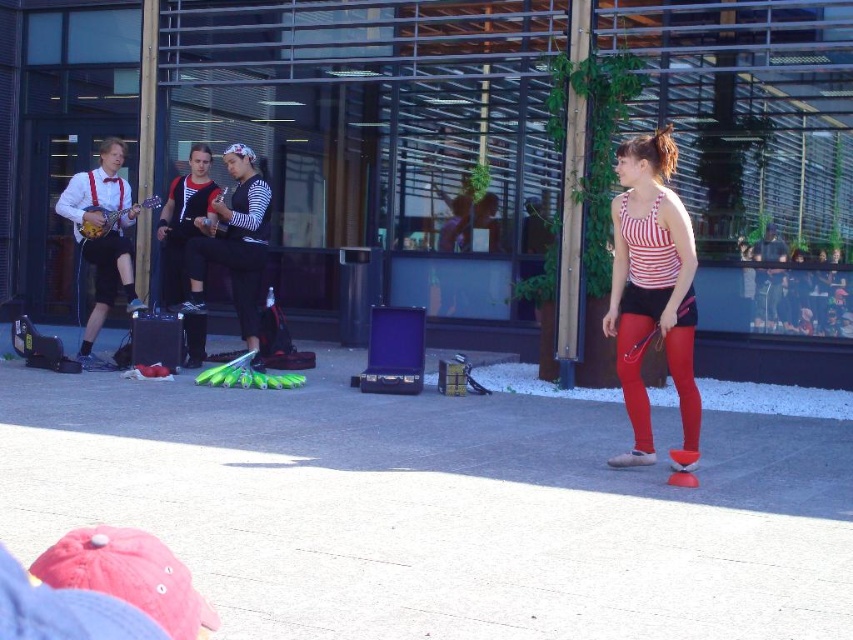
You are a photographer trying to capture a photo of the striped fabric top at center and the red matte leggings at center in the same frame. Given that your camera has a maximum focus range of 4.5 meters, will you be able to capture both objects in focus without moving your position?

The striped fabric top at center and red matte leggings at center are 4.60 meters apart, which exceeds the camera maximum focus range of 4.5 meters. Therefore, you cannot capture both objects in focus without moving your position.

You are a street performer who needs to place a 4.5 feet long ladder between the smooth concrete pavement at center and the striped fabric tank top at center. Is there enough space?

The smooth concrete pavement at center is 5.39 feet away from the striped fabric tank top at center. Since the ladder is 4.5 feet long, there is enough space to place it between them.